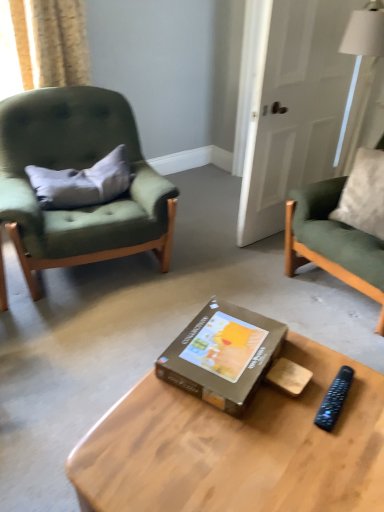
Where is `free area in between black plastic remote at lower right and brown cardboard box at center`? The width and height of the screenshot is (384, 512). free area in between black plastic remote at lower right and brown cardboard box at center is located at coordinates (302, 392).